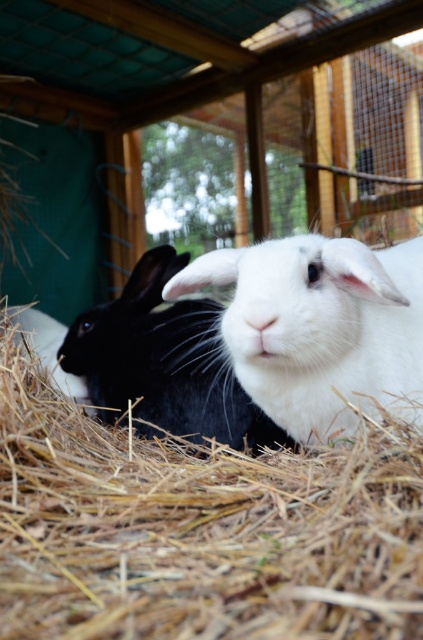
Which is more to the left, straw hay at center or white soft fur rabbit at center?

straw hay at center is more to the left.

Can you confirm if straw hay at center is positioned to the right of white soft fur rabbit at center?

Incorrect, straw hay at center is not on the right side of white soft fur rabbit at center.

Is point (269, 497) in front of point (266, 285)?

Yes, point (269, 497) is closer to viewer.

The height and width of the screenshot is (640, 423). Find the location of `straw hay at center`. straw hay at center is located at coordinates (197, 529).

Is straw hay at center positioned before black soft fur rabbit at left?

Yes, it is.

The width and height of the screenshot is (423, 640). What do you see at coordinates (197, 529) in the screenshot?
I see `straw hay at center` at bounding box center [197, 529].

The height and width of the screenshot is (640, 423). I want to click on straw hay at center, so click(197, 529).

Can you confirm if white soft fur rabbit at center is thinner than black soft fur rabbit at left?

Indeed, white soft fur rabbit at center has a lesser width compared to black soft fur rabbit at left.

Describe the element at coordinates (320, 328) in the screenshot. I see `white soft fur rabbit at center` at that location.

Does point (299, 321) come closer to viewer compared to point (159, 284)?

Yes, it is.

You are a GUI agent. You are given a task and a screenshot of the screen. Output one action in this format:
    pyautogui.click(x=<x>, y=<y>)
    Task: Click on the white soft fur rabbit at center
    This screenshot has height=640, width=423.
    Given the screenshot: What is the action you would take?
    (320, 328)